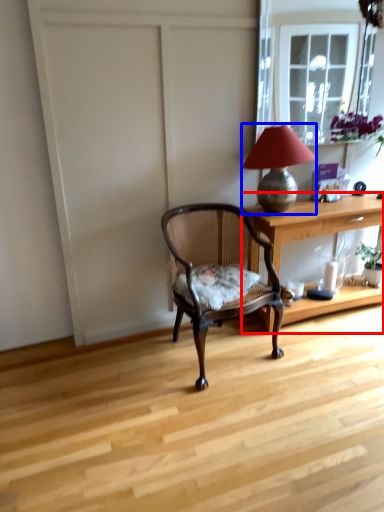
Question: Which object appears farthest to the camera in this image, desk (highlighted by a red box) or lamp (highlighted by a blue box)?

Choices:
 (A) desk
 (B) lamp

Answer: (A)